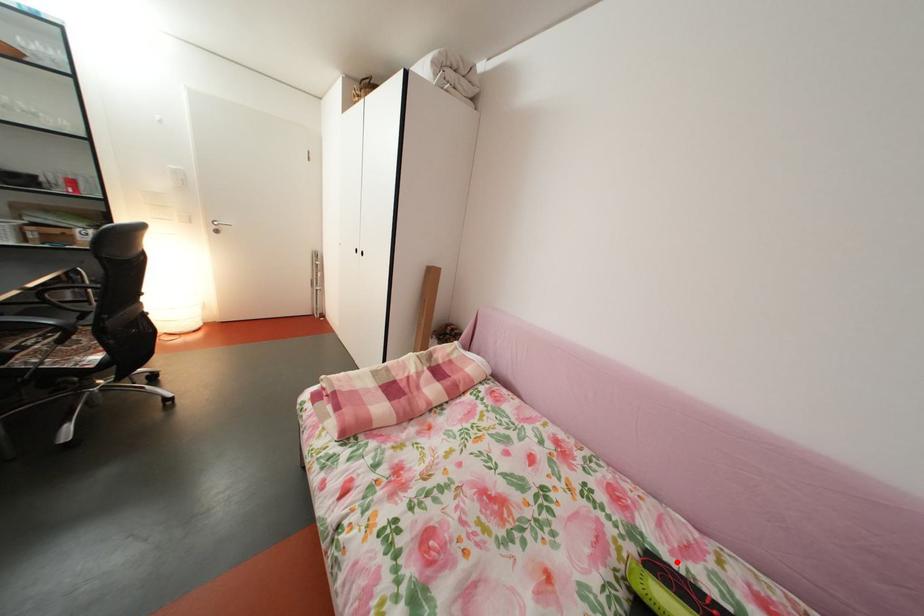
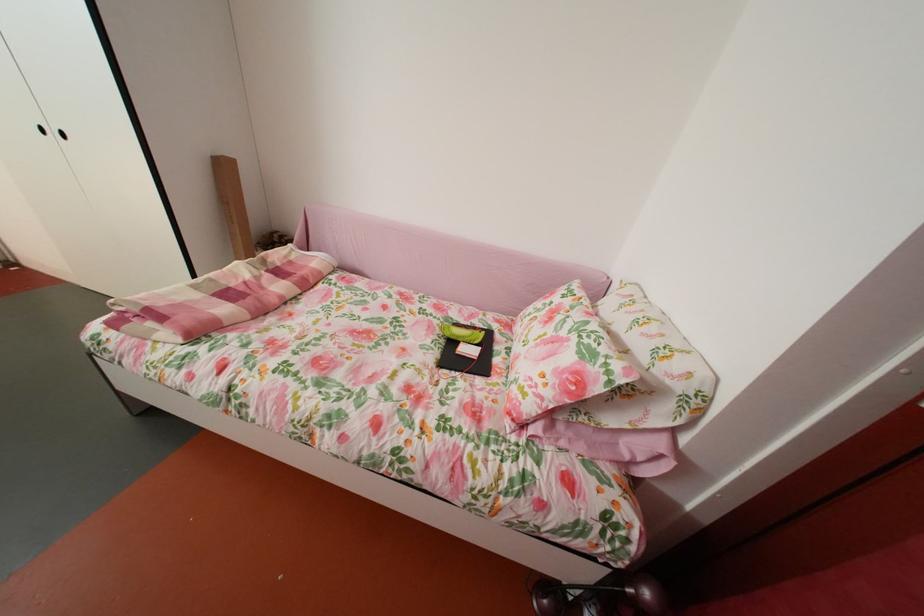
Question: I am providing you with two images of the same scene from different viewpoints. A red point is marked on the first image. Can you still see the location of the red point in image 2?

Choices:
 (A) Yes
 (B) No

Answer: (A)